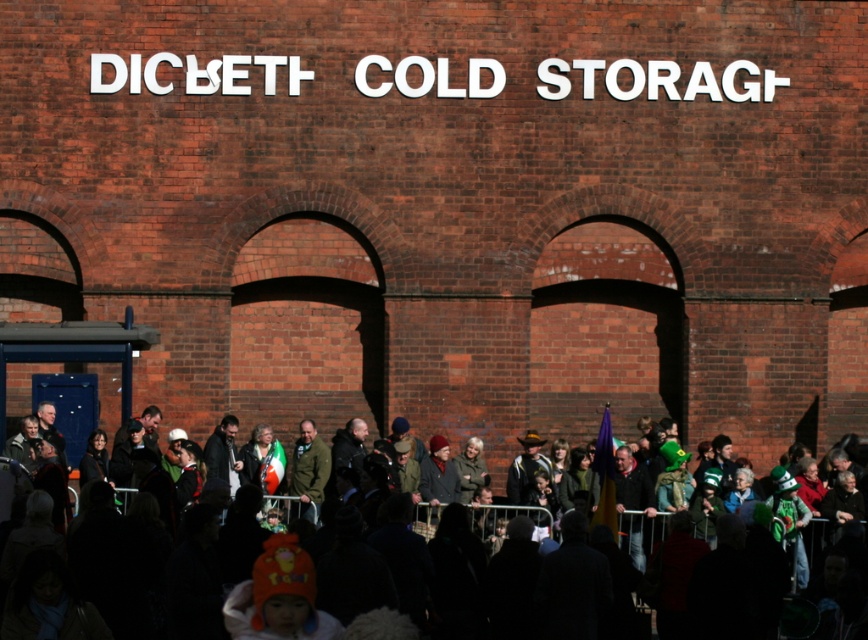
Question: Is dark clothing crowd at center smaller than green fabric jacket at center?

Choices:
 (A) yes
 (B) no

Answer: (B)

Question: Does dark clothing crowd at center have a larger size compared to green fabric jacket at center?

Choices:
 (A) no
 (B) yes

Answer: (B)

Question: Is dark clothing crowd at center further to the viewer compared to green fabric jacket at center?

Choices:
 (A) no
 (B) yes

Answer: (A)